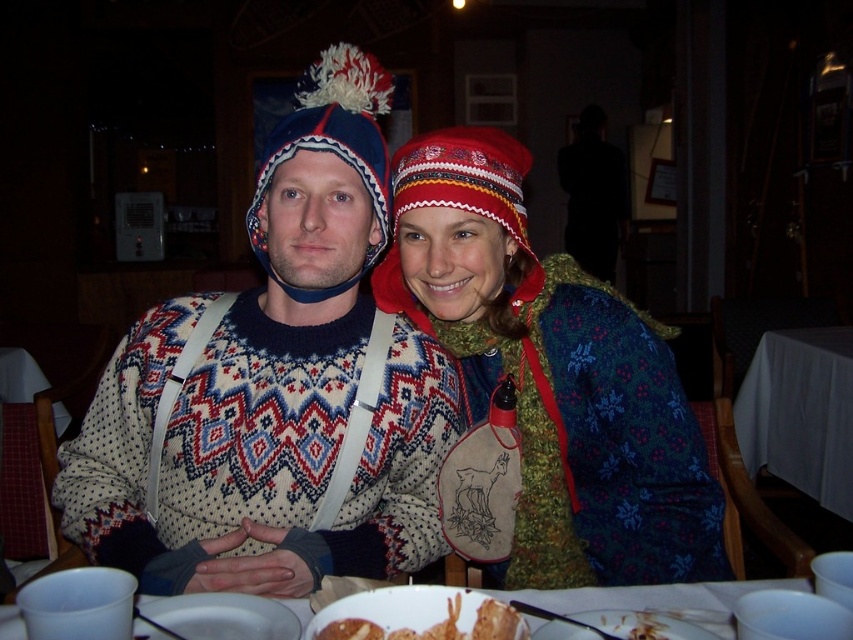
Who is positioned more to the left, white cloth table at center or knitted woolen hat at center?

knitted woolen hat at center is more to the left.

Can you confirm if white cloth table at center is positioned below knitted woolen hat at center?

Yes.

This screenshot has height=640, width=853. Identify the location of white cloth table at center. (799, 412).

The image size is (853, 640). In order to click on white cloth table at center in this screenshot , I will do `click(799, 412)`.

Is white plastic cups at lower center smaller than white matte plate at lower center?

Incorrect, white plastic cups at lower center is not smaller in size than white matte plate at lower center.

Who is more forward, (724, 584) or (242, 634)?

Point (242, 634) is more forward.

Locate an element on the screen. white plastic cups at lower center is located at coordinates (659, 600).

Is knitted wool sweater at center positioned behind white matte plate at lower center?

That is True.

Is knitted wool sweater at center bigger than white matte plate at lower center?

Indeed, knitted wool sweater at center has a larger size compared to white matte plate at lower center.

Locate an element on the screen. Image resolution: width=853 pixels, height=640 pixels. knitted wool sweater at center is located at coordinates (553, 376).